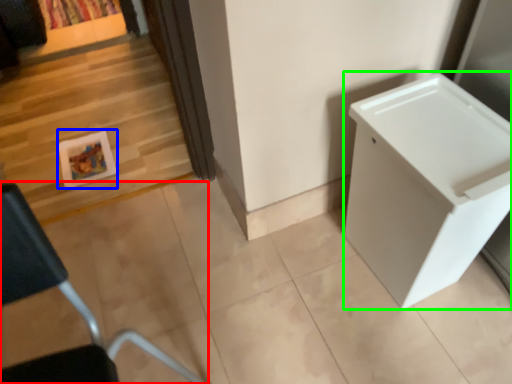
Question: Which is farther away from furniture (highlighted by a red box)? picture frame (highlighted by a blue box) or changing table (highlighted by a green box)?

Choices:
 (A) picture frame
 (B) changing table

Answer: (A)